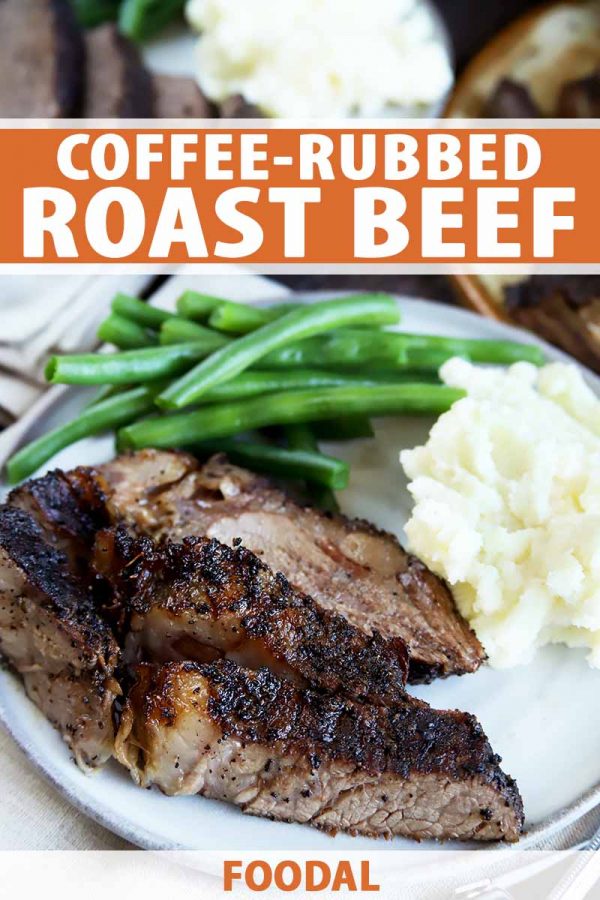
Where is `white plate`? white plate is located at coordinates (527, 753).